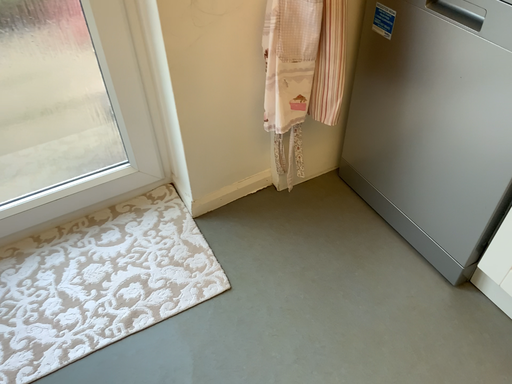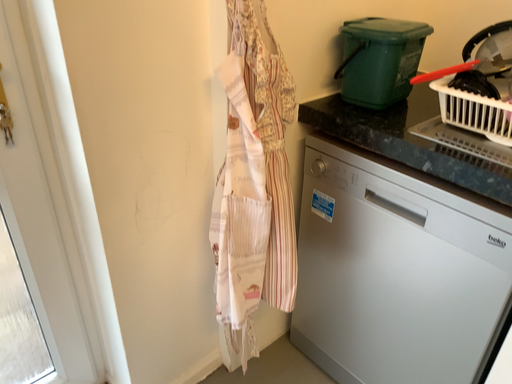
Question: Which way did the camera rotate in the video?

Choices:
 (A) rotated downward
 (B) rotated upward

Answer: (B)